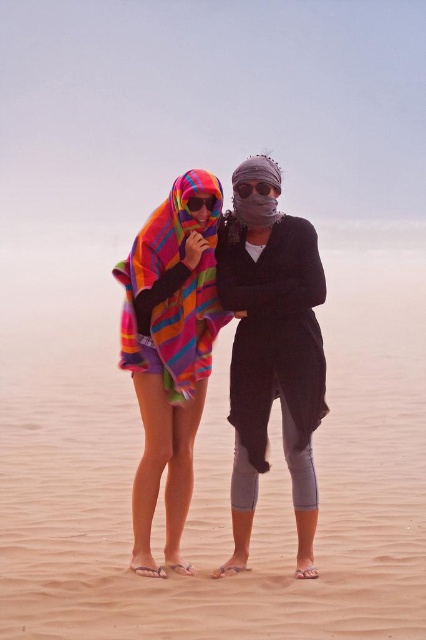
You are a photographer trying to capture both the matte black goggles at center and the multicolored fabric goggles at center in a single frame. Based on their positions, which goggles should you focus on first to ensure they are centered in your shot?

The multicolored fabric goggles at center should be focused on first since the matte black goggles at center are positioned to the right of them, meaning the multicolored ones are closer to the center of the frame.

Consider the image. You are trying to decide which item to use to cover yourself from the sun. The multicolored woven towel at center and the multicolored woven blanket at center are available. Which one would provide more coverage area?

The multicolored woven towel at center has a larger width than the multicolored woven blanket at center, so it would provide more coverage area.